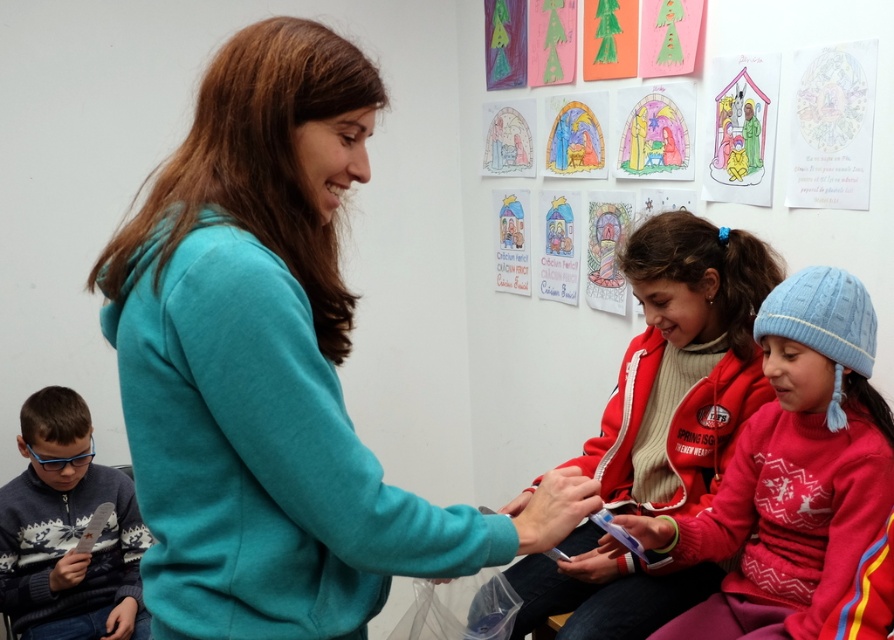
You are a photographer standing at the camera position. You want to take a closeup photo of the red fleece jacket at center. Can you get it in focus without moving the camera?

The red fleece jacket at center is 4.95 feet away from the camera. Since most cameras can focus on objects within 5 feet, it should be possible to take a closeup photo of the red fleece jacket at center without moving the camera.

You are a tailor who needs to determine which clothing item requires more fabric for alterations. Based on the scene, which item has a greater width between the teal soft hoodie at center and the red fleece jacket at center?

The teal soft hoodie at center has a greater width than the red fleece jacket at center, so it would require more fabric for alterations.

You are a tailor who needs to determine which clothing item requires more fabric to make between the teal soft hoodie at center and the red fleece jacket at center. Based on their sizes, which one would need more fabric?

The red fleece jacket at center requires more fabric because it is larger in size than the teal soft hoodie at center.